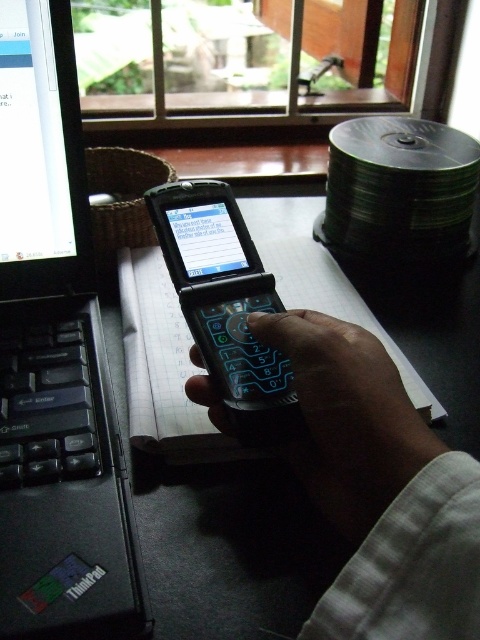
Question: Which of the following is the farthest from the observer?

Choices:
 (A) black matte phone at center
 (B) black plastic phone at center
 (C) black plastic laptop at left
 (D) black plastic table at center

Answer: (B)

Question: Can you confirm if black plastic laptop at left is smaller than black matte phone at center?

Choices:
 (A) yes
 (B) no

Answer: (B)

Question: Is black plastic phone at center closer to camera compared to black plastic table at center?

Choices:
 (A) no
 (B) yes

Answer: (A)

Question: Which point is farther to the camera?

Choices:
 (A) (363, 518)
 (B) (237, 291)

Answer: (B)

Question: Does black matte phone at center appear on the left side of black plastic phone at center?

Choices:
 (A) yes
 (B) no

Answer: (B)

Question: Which is nearer to the black plastic phone at center?

Choices:
 (A) black plastic laptop at left
 (B) black plastic table at center
 (C) black matte phone at center

Answer: (C)